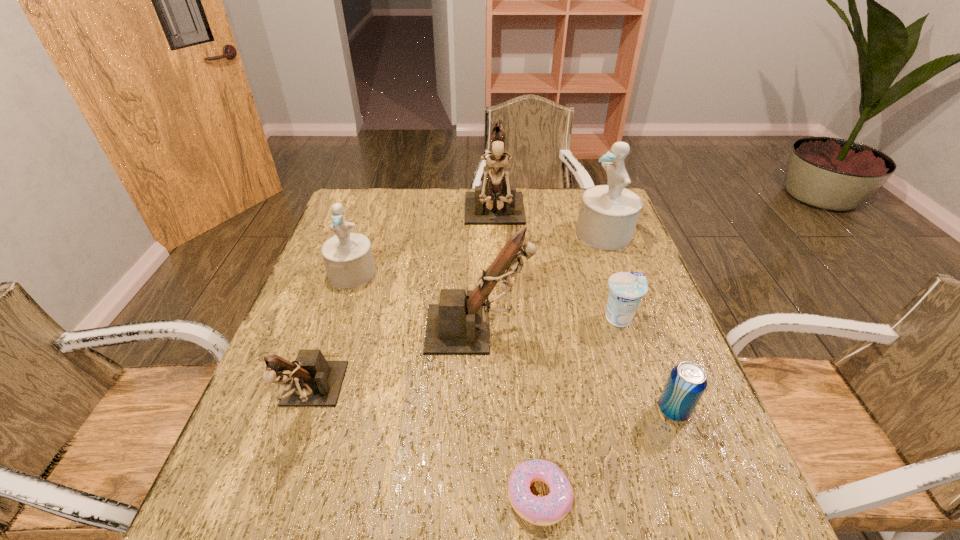
The image size is (960, 540). I want to click on vacant space that satisfies the following two spatial constraints: 1. at the beak of the blue yogurt; 2. on the right side of the third farthest object, so [337, 318].

The width and height of the screenshot is (960, 540). I want to click on free location that satisfies the following two spatial constraints: 1. at the beak of the yogurt; 2. on the left side of the sixth nearest object, so tap(337, 318).

The width and height of the screenshot is (960, 540). Find the location of `vacant area that satisfies the following two spatial constraints: 1. on the front-facing side of the nearest brown figurine; 2. on the right side of the beer can`. vacant area that satisfies the following two spatial constraints: 1. on the front-facing side of the nearest brown figurine; 2. on the right side of the beer can is located at coordinates (306, 410).

At what (x,y) coordinates should I click in order to perform the action: click on free space that satisfies the following two spatial constraints: 1. on the front-facing side of the fourth farthest figurine; 2. on the front-facing side of the nearest figurine. Please return your answer as a coordinate pair (x, y). This screenshot has width=960, height=540. Looking at the image, I should click on (477, 398).

Image resolution: width=960 pixels, height=540 pixels. In order to click on free location that satisfies the following two spatial constraints: 1. at the beak of the smaller white figurine; 2. on the right side of the beer can in this screenshot , I will do `click(306, 410)`.